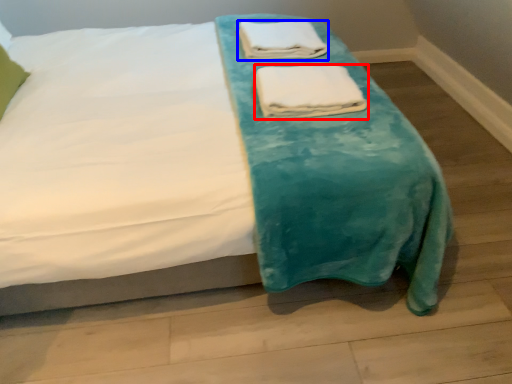
Question: Which object appears closest to the camera in this image, towel (highlighted by a red box) or towel (highlighted by a blue box)?

Choices:
 (A) towel
 (B) towel

Answer: (A)